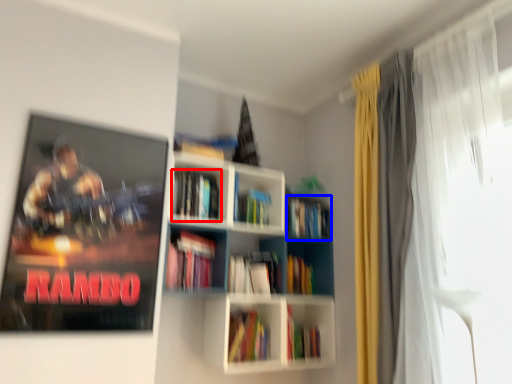
Question: Which object is further to the camera taking this photo, book (highlighted by a red box) or book (highlighted by a blue box)?

Choices:
 (A) book
 (B) book

Answer: (B)